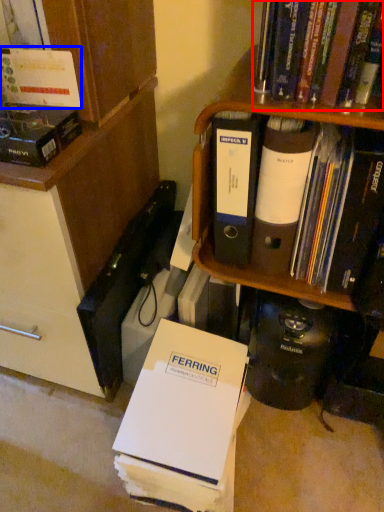
Question: Among these objects, which one is farthest to the camera, book (highlighted by a red box) or book (highlighted by a blue box)?

Choices:
 (A) book
 (B) book

Answer: (B)